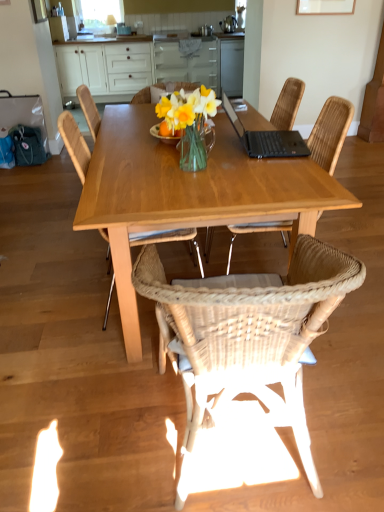
Question: Considering their positions, is woven wood chair at center, positioned as the first chair in left-to-right order, located in front of or behind woven rattan chair at center, the first chair in the right-to-left sequence?

Choices:
 (A) behind
 (B) front

Answer: (B)

Question: From a real-world perspective, is woven wood chair at center, positioned as the first chair in left-to-right order, positioned above or below woven rattan chair at center, the third chair viewed from the left?

Choices:
 (A) below
 (B) above

Answer: (A)

Question: Estimate the real-world distances between objects in this image. Which object is closer to the woven rattan chair at center, arranged as the 2th chair when viewed from the left?

Choices:
 (A) woven rattan chair at center, the first chair in the right-to-left sequence
 (B) white wood cabinets at upper center
 (C) black matte laptop at upper right
 (D) wooden table at center
 (E) transparent glass window screen at upper center

Answer: (D)

Question: Estimate the real-world distances between objects in this image. Which object is closer to the woven rattan chair at center, the first chair in the right-to-left sequence?

Choices:
 (A) woven wood chair at center, positioned as the first chair in left-to-right order
 (B) transparent glass window screen at upper center
 (C) woven rattan chair at center, arranged as the 2th chair when viewed from the left
 (D) white wood cabinets at upper center
 (E) black matte laptop at upper right

Answer: (A)